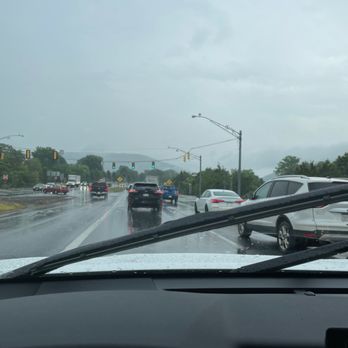
Identify the location of hoods. (180, 267), (38, 187), (71, 182).